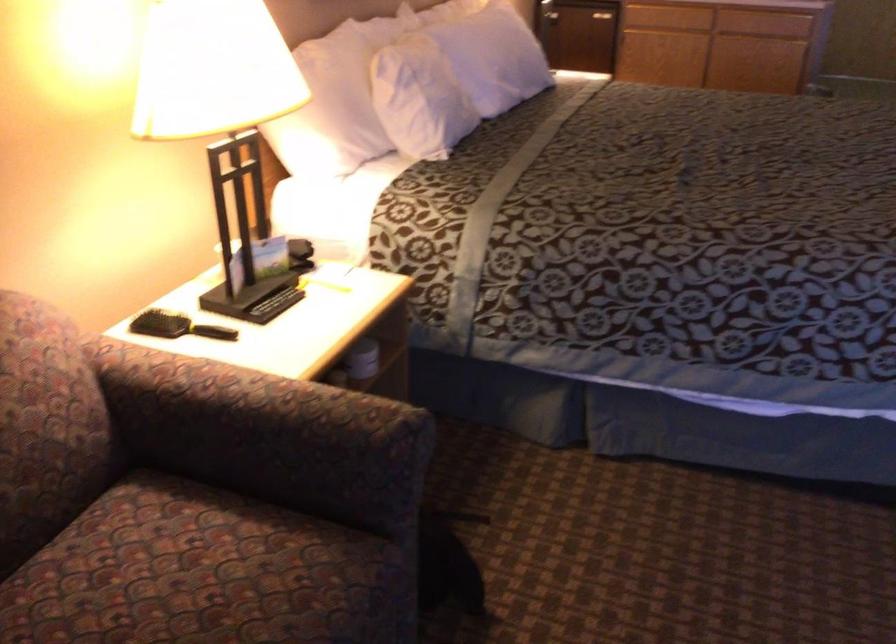
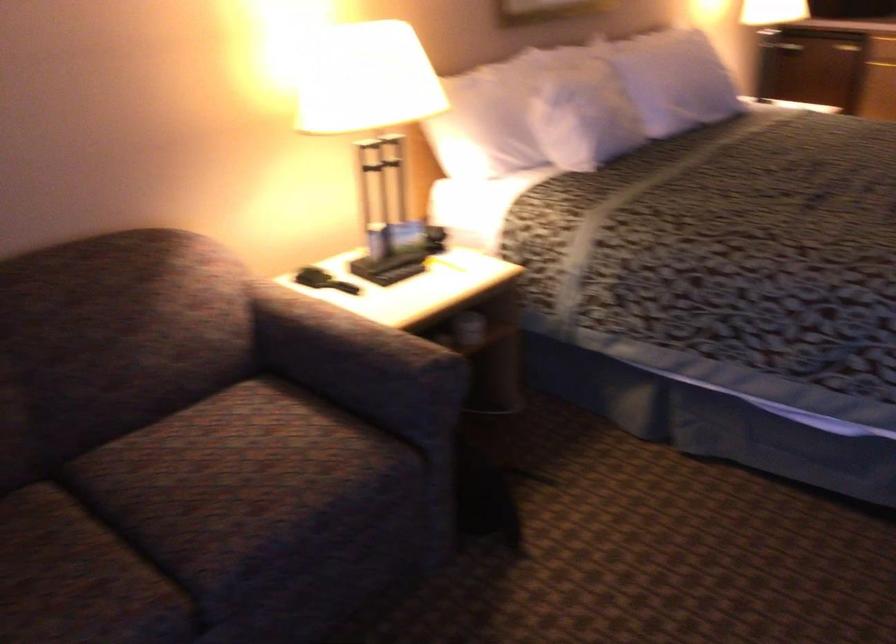
Question: Based on the continuous images, in which direction is the camera rotating? Reply with the corresponding letter.

Choices:
 (A) Left
 (B) Right
 (C) Up
 (D) Down

Answer: (A)